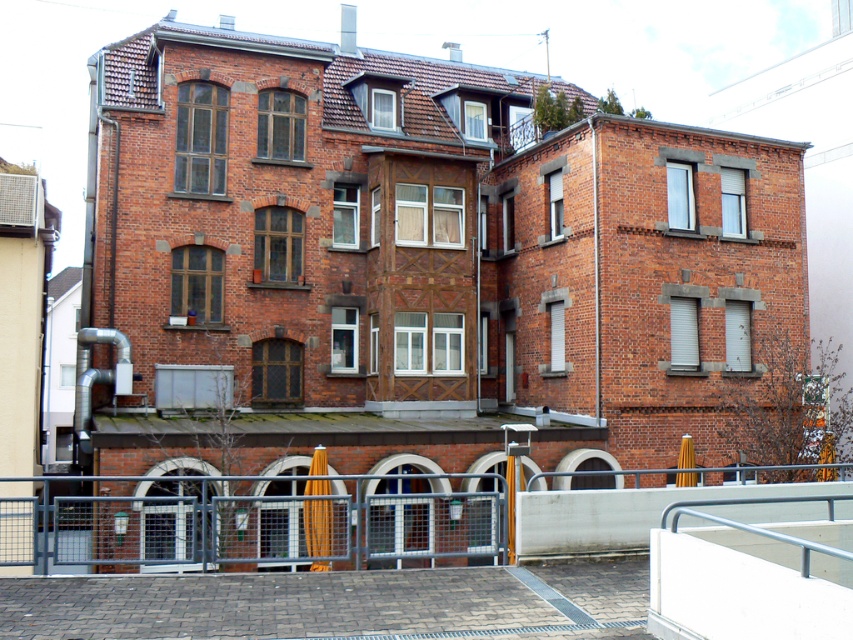
Question: Which of the following is the farthest from the observer?

Choices:
 (A) silver metallic rail at lower right
 (B) metal mesh fence at lower center

Answer: (B)

Question: Is the position of metal mesh fence at lower center more distant than that of silver metallic rail at lower right?

Choices:
 (A) no
 (B) yes

Answer: (B)

Question: Is the position of metal mesh fence at lower center more distant than that of silver metallic rail at lower right?

Choices:
 (A) no
 (B) yes

Answer: (B)

Question: Is metal mesh fence at lower center wider than silver metallic rail at lower right?

Choices:
 (A) yes
 (B) no

Answer: (A)